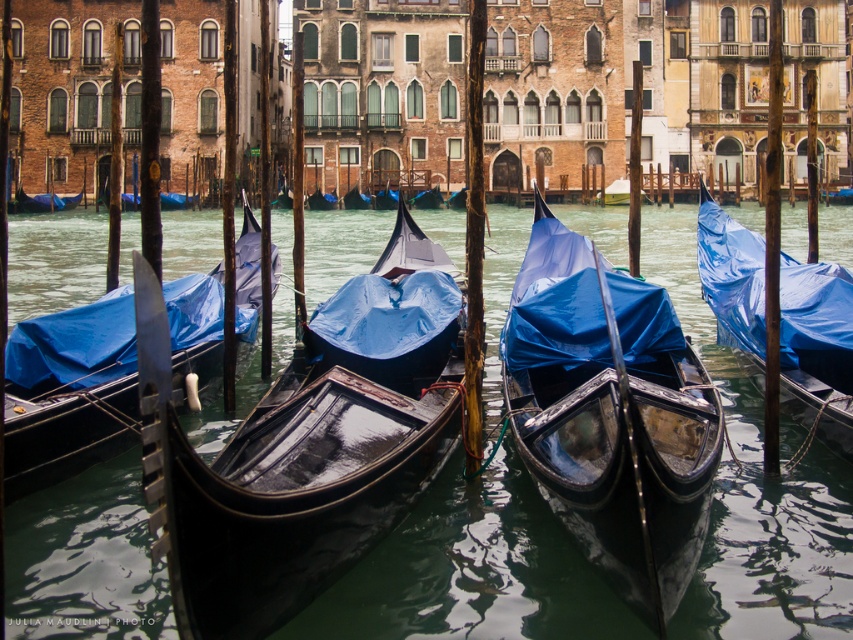
You are a tour guide explaining the canal scene to visitors. You mention the shiny black canoe at center and the blue tarpaulin gondola at center. Which one is wider?

The shiny black canoe at center is wider than the blue tarpaulin gondola at center.

You are standing at the edge of the canal in Venice, Italy, and you want to take a photo of the glossy black gondolas at center. If your camera has a maximum focus range of 150 feet, will you be able to capture them clearly?

The glossy black gondolas at center and the camera are 157.62 feet apart. Since the distance exceeds the camera maximum focus range of 150 feet, you won not be able to capture them clearly.